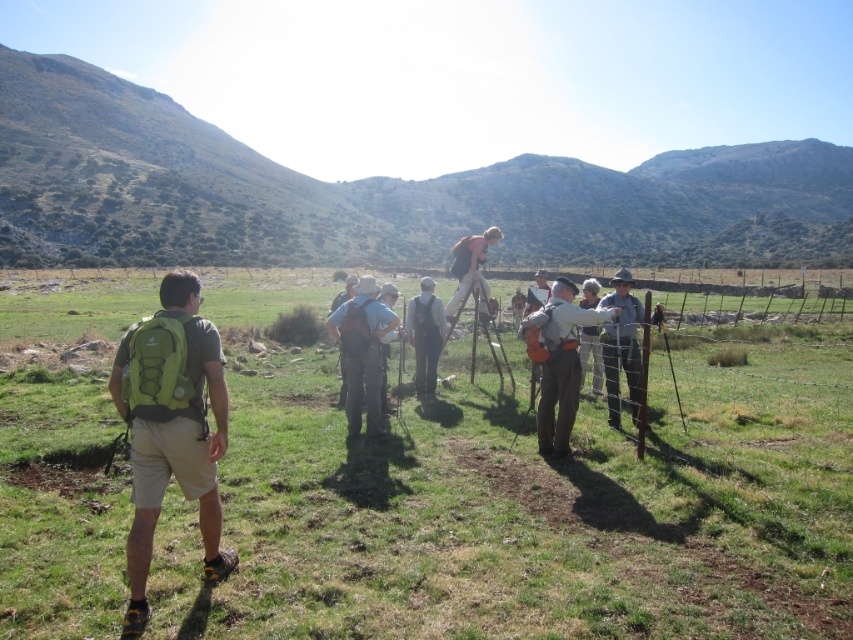
Is green grassy field at center taller than orange fabric backpack at right?

Yes, green grassy field at center is taller than orange fabric backpack at right.

Who is higher up, green grassy field at center or orange fabric backpack at right?

green grassy field at center

Find the location of a particular element. The height and width of the screenshot is (640, 853). green grassy field at center is located at coordinates (521, 496).

Find the location of a particular element. The height and width of the screenshot is (640, 853). green grassy field at center is located at coordinates (521, 496).

Is khaki fabric shirt at right below pink fabric at upper center?

Yes, khaki fabric shirt at right is below pink fabric at upper center.

Who is taller, khaki fabric shirt at right or pink fabric at upper center?

With more height is pink fabric at upper center.

This screenshot has width=853, height=640. Describe the element at coordinates (621, 346) in the screenshot. I see `khaki fabric shirt at right` at that location.

Find the location of a particular element. Image resolution: width=853 pixels, height=640 pixels. khaki fabric shirt at right is located at coordinates (621, 346).

Which is more to the left, khaki fabric shirt at right or light gray backpack at center?

light gray backpack at center

Can you confirm if khaki fabric shirt at right is positioned to the left of light gray backpack at center?

In fact, khaki fabric shirt at right is to the right of light gray backpack at center.

Is point (602, 358) positioned behind point (434, 308)?

No, it is in front of (434, 308).

Image resolution: width=853 pixels, height=640 pixels. I want to click on khaki fabric shirt at right, so [x=621, y=346].